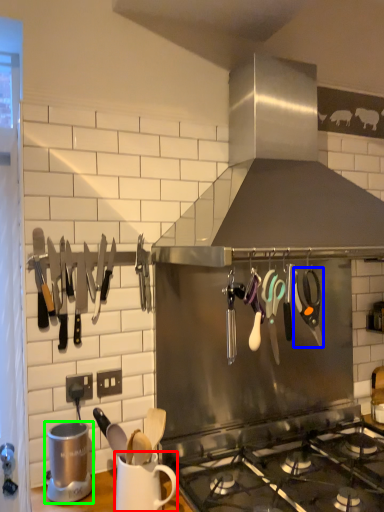
Question: Which object is positioned closest to mug (highlighted by a red box)? Select from scissors (highlighted by a blue box) and appliance (highlighted by a green box).

Choices:
 (A) scissors
 (B) appliance

Answer: (B)